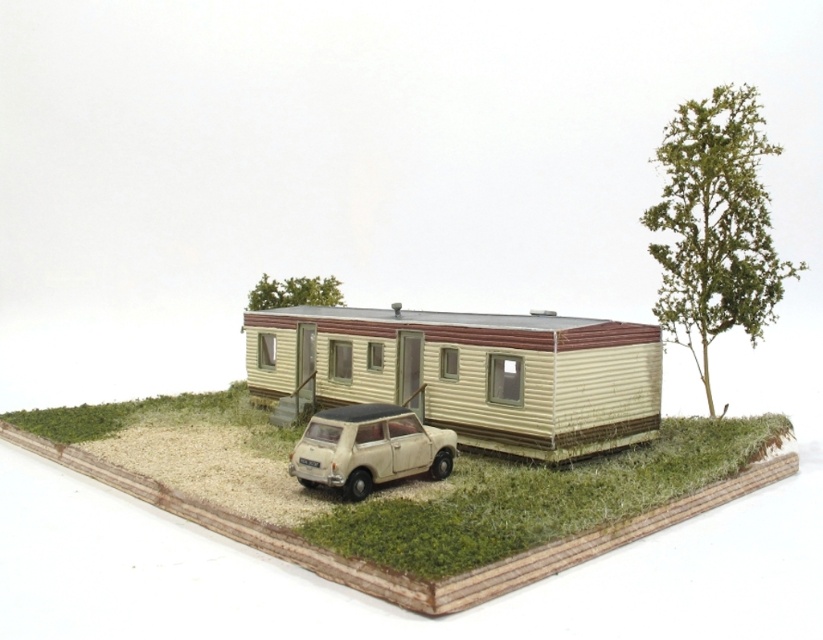
Is the position of green grass at lower center more distant than that of white matte car at center?

That is False.

Is green grass at lower center in front of white matte car at center?

Yes, green grass at lower center is closer to the viewer.

Between point (375, 528) and point (372, 404), which one is positioned in front?

Point (375, 528) is in front.

This screenshot has height=640, width=823. Identify the location of green grass at lower center. (537, 499).

Looking at this image, can you confirm if green grass at lower center is wider than green leafy tree at upper center?

Correct, the width of green grass at lower center exceeds that of green leafy tree at upper center.

Which is in front, point (751, 445) or point (331, 278)?

Point (751, 445) is more forward.

You are a GUI agent. You are given a task and a screenshot of the screen. Output one action in this format:
    pyautogui.click(x=<x>, y=<y>)
    Task: Click on the green grass at lower center
    
    Given the screenshot: What is the action you would take?
    pyautogui.click(x=537, y=499)

Find the location of `white matte car at center`. white matte car at center is located at coordinates (368, 449).

Does white matte car at center have a lesser width compared to green leafy tree at upper center?

No, white matte car at center is not thinner than green leafy tree at upper center.

Who is more distant from viewer, [321,426] or [308,300]?

Point [308,300]

I want to click on white matte car at center, so click(368, 449).